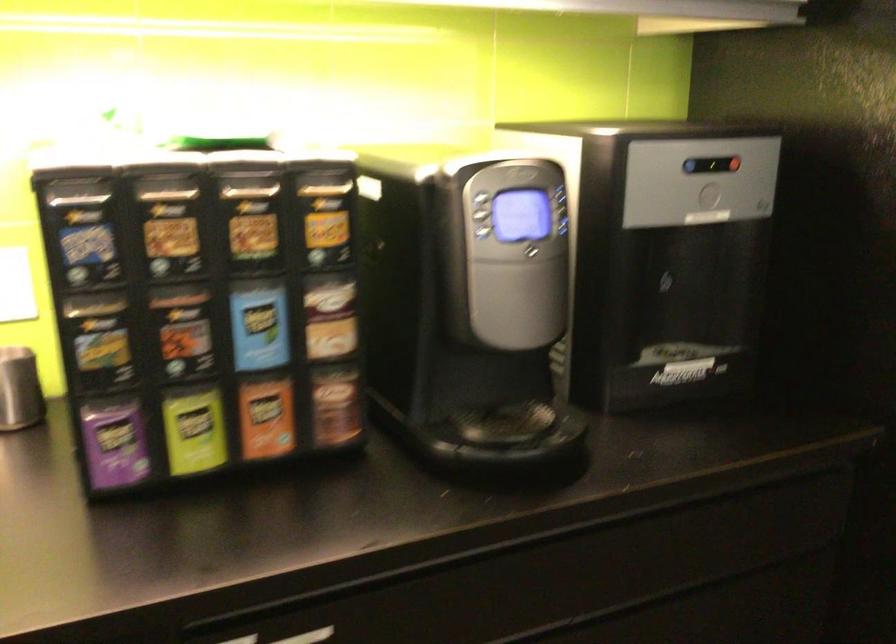
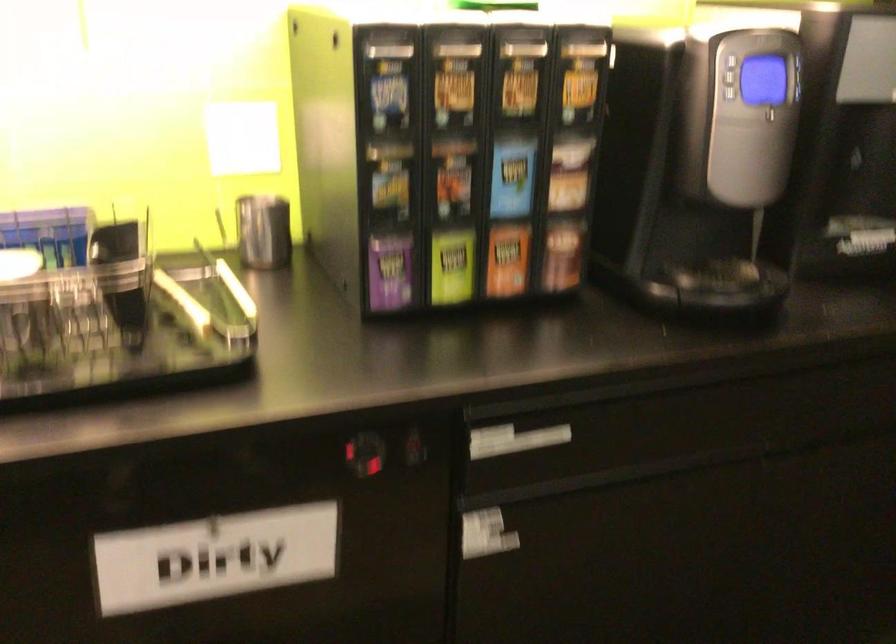
Question: The first image is from the beginning of the video and the second image is from the end. How did the camera likely rotate when shooting the video?

Choices:
 (A) Left
 (B) Right
 (C) Up
 (D) Down

Answer: (D)